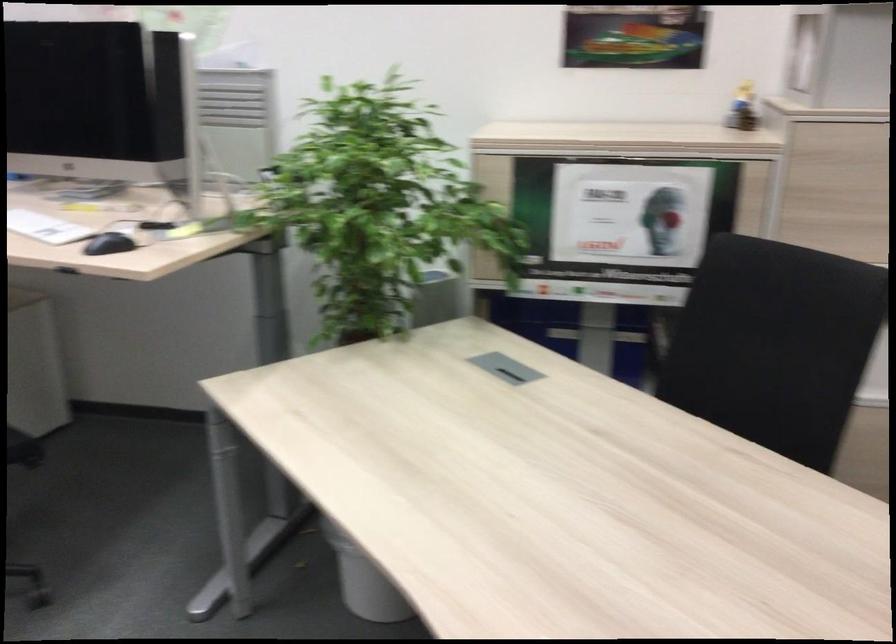
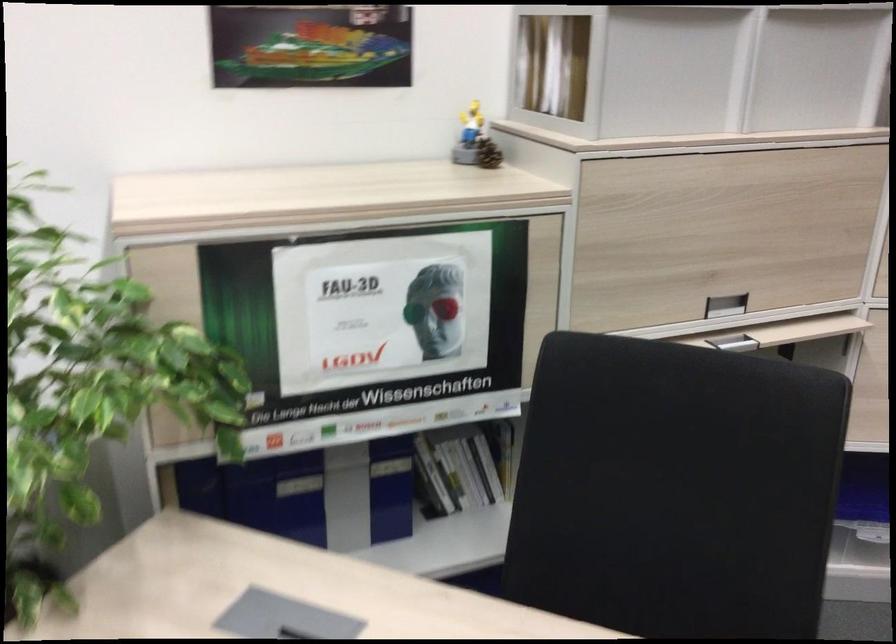
Question: Based on the continuous images, in which direction is the camera rotating? Reply with the corresponding letter.

Choices:
 (A) Left
 (B) Right
 (C) Up
 (D) Down

Answer: (B)